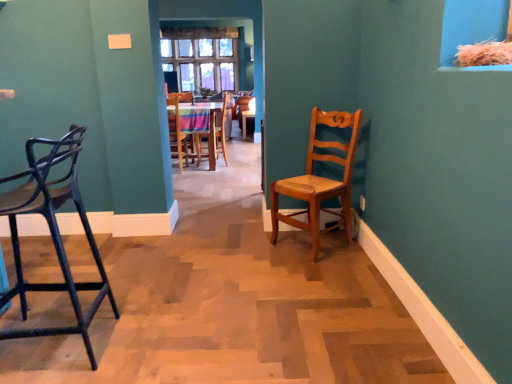
Question: From a real-world perspective, is matte black stool at left, the 5th chair viewed from the back, above or below light brown wooden chair at center, which ranks as the fourth chair in back-to-front order?

Choices:
 (A) above
 (B) below

Answer: (A)

Question: Is matte black stool at left, the 5th chair viewed from the back, taller or shorter than light brown wooden chair at center, which is counted as the 2th chair, starting from the front?

Choices:
 (A) short
 (B) tall

Answer: (B)

Question: Which object is the farthest from the wooden chair at center, the 4th chair from the front?

Choices:
 (A) wooden chair at center, the first chair when ordered from back to front
 (B) matte black stool at left, the 5th chair viewed from the back
 (C) light brown wooden chair at center, which ranks as the fourth chair in back-to-front order
 (D) wooden chair at center, the third chair in the back-to-front sequence

Answer: (B)

Question: Which object is the farthest from the light brown wooden chair at center, which is counted as the 2th chair, starting from the front?

Choices:
 (A) wooden chair at center, the third chair in the back-to-front sequence
 (B) matte black stool at left, which is counted as the first chair, starting from the front
 (C) wooden chair at center, which is counted as the second chair, starting from the back
 (D) wooden chair at center, the first chair when ordered from back to front

Answer: (A)